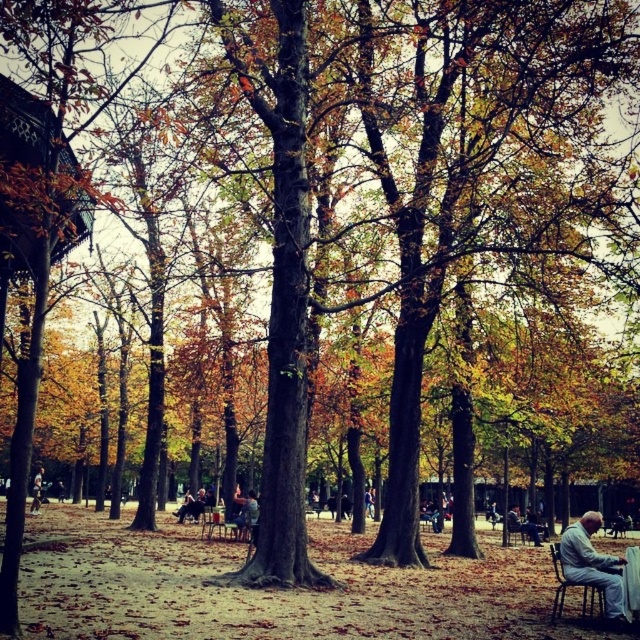
Question: Which point is closer to the camera?

Choices:
 (A) light brown leather jacket at lower left
 (B) light gray fabric jacket at lower right
 (C) wooden chair at lower right
 (D) gray fabric jacket at lower right

Answer: (B)

Question: In this image, where is wooden chair at lower right located relative to gray fabric jacket at lower right?

Choices:
 (A) below
 (B) above

Answer: (B)

Question: Does wooden chair at lower right have a smaller size compared to light brown leather jacket at lower left?

Choices:
 (A) no
 (B) yes

Answer: (B)

Question: Which of the following is the farthest from the observer?

Choices:
 (A) light gray fabric jacket at lower right
 (B) gray fabric jacket at lower right

Answer: (B)

Question: Which of the following is the farthest from the observer?

Choices:
 (A) gray fabric jacket at lower right
 (B) wooden chair at lower right

Answer: (A)

Question: Can you confirm if light gray fabric jacket at lower right is positioned to the right of light brown leather jacket at lower left?

Choices:
 (A) no
 (B) yes

Answer: (B)